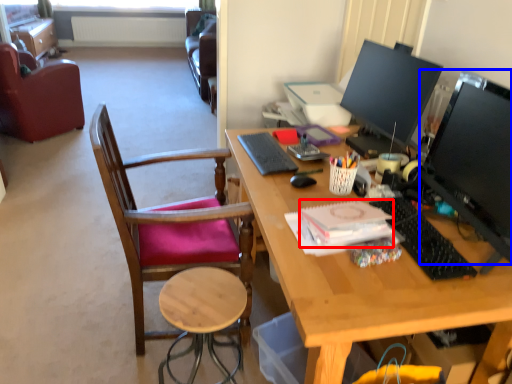
Question: Which of the following is the closest to the observer, notepad (highlighted by a red box) or television (highlighted by a blue box)?

Choices:
 (A) notepad
 (B) television

Answer: (B)